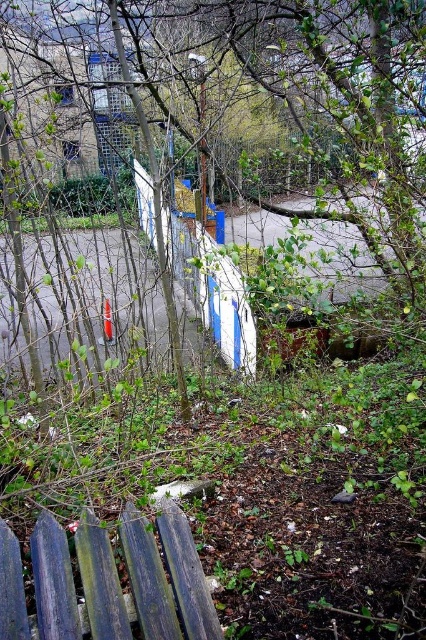
You are a gardener planning to plant a new flower bed. You see the green leafy tree at center and the blue weathered wood at lower left. Which object is located above the other?

The green leafy tree at center is positioned over the blue weathered wood at lower left.

You are a gardener with a 2.5 meter long ladder. You need to place it between the green leafy tree at center and the blue weathered wood at lower left. Will the ladder fit horizontally between them?

The distance between the green leafy tree at center and the blue weathered wood at lower left is 1.91 meters, so the 2.5 meter ladder will not fit horizontally between them as it is longer than the space available.

You are a gardener planning to plant a new tree in this area. Given the green leafy tree at center and the blue weathered wood at lower left, which object occupies more horizontal space in the scene?

The green leafy tree at center occupies more horizontal space because its width is larger than the blue weathered wood at lower left.